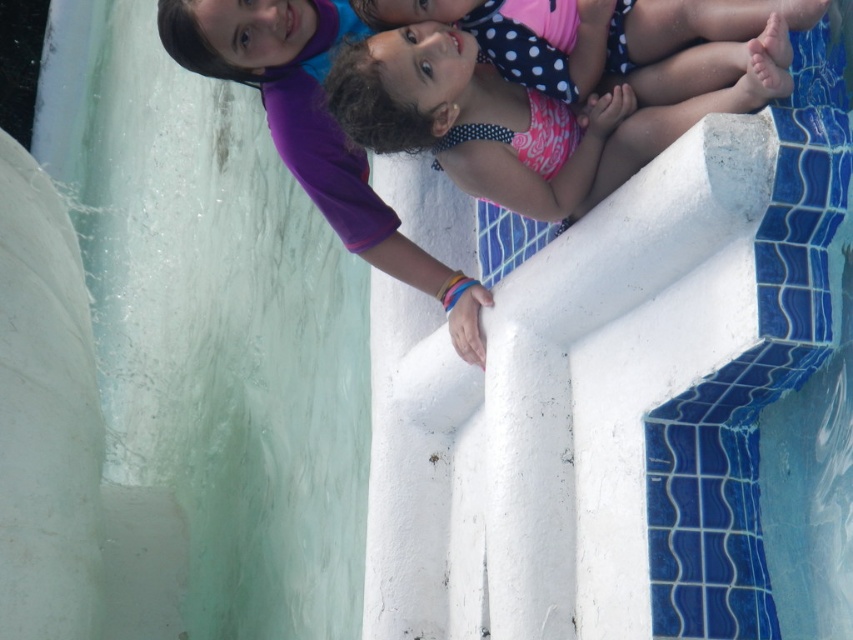
You are a lifeguard standing at the edge of the pool. You need to reach both the purple fabric at upper center and the pink polka dot swimsuit at center quickly. Can you reach both items within 1 meter of your current position?

The distance between the purple fabric at upper center and the pink polka dot swimsuit at center is 1.28 meters. Since the distance exceeds 1 meter, you cannot reach both items within 1 meter from your current position.

You are standing at the edge of the pool and want to place a small float between the two points indicated by the coordinates point (x=708, y=54) and point (x=35, y=208). Based on their positions, which point should the float be closer to in order to be between them?

The float should be closer to point (x=35, y=208) because point (x=708, y=54) is in front of point (x=35, y=208), meaning the latter is behind the former.

Based on the scene description, can you determine if the person in the pink polka dot swimsuit at upper center is sitting on the smooth white slide at left?

The pink polka dot swimsuit at upper center is positioned over the smooth white slide at left, so yes, the person in the pink polka dot swimsuit at upper center is sitting on the smooth white slide at left.